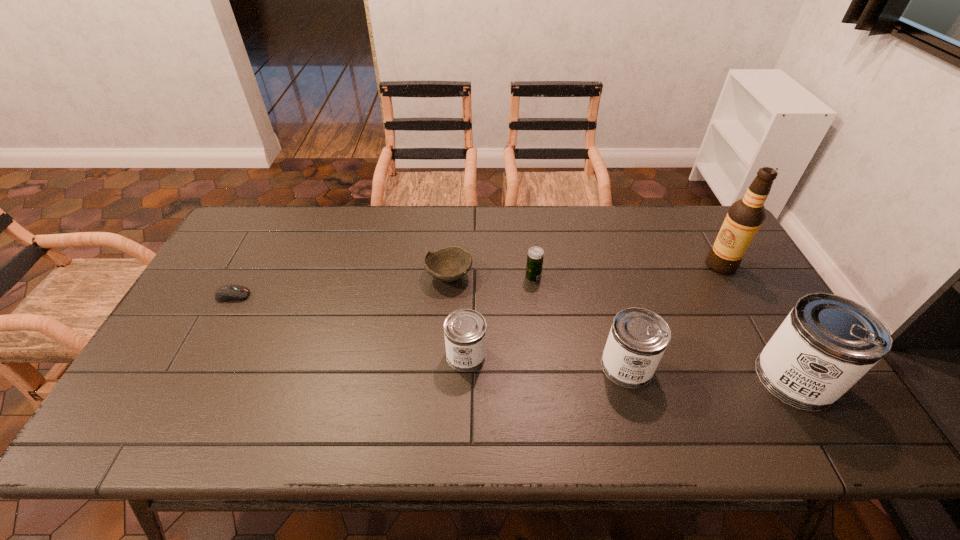
Locate an element on the screen. vacant space that satisfies the following two spatial constraints: 1. on the button of the rightmost can; 2. on the right side of the shortest object is located at coordinates coord(188,378).

The height and width of the screenshot is (540, 960). I want to click on free spot that satisfies the following two spatial constraints: 1. on the button of the leftmost object; 2. on the back side of the leftmost can, so click(201, 355).

This screenshot has width=960, height=540. In order to click on free spot that satisfies the following two spatial constraints: 1. on the back side of the fifth shortest object; 2. on the button of the shortest object in this screenshot , I will do pos(608,295).